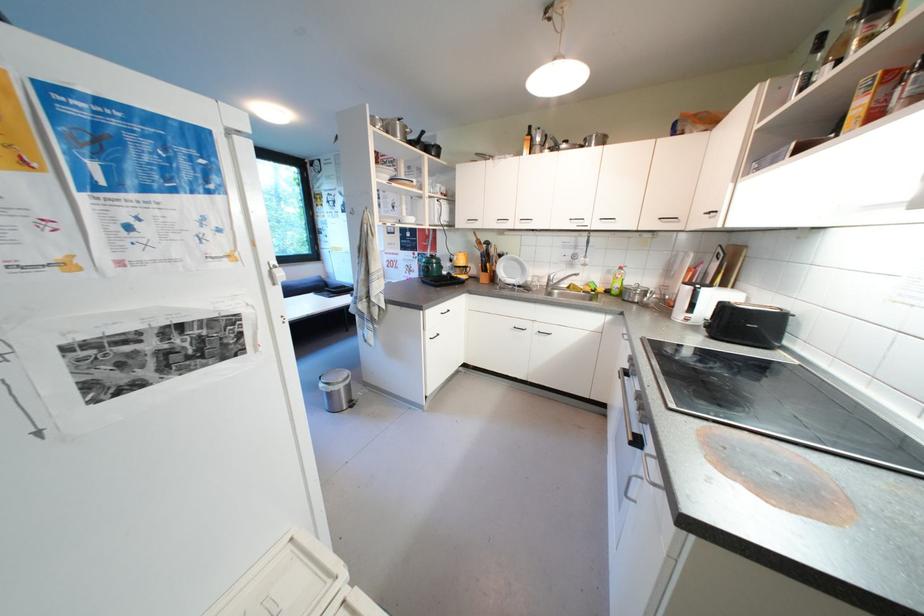
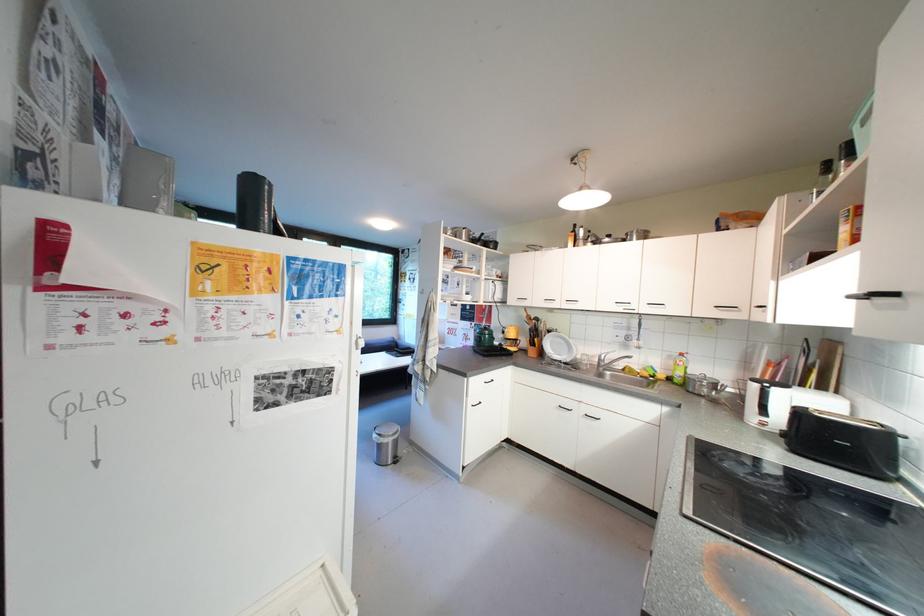
Where in the second image is the point corresponding to pixel 330 387 from the first image?

(383, 438)